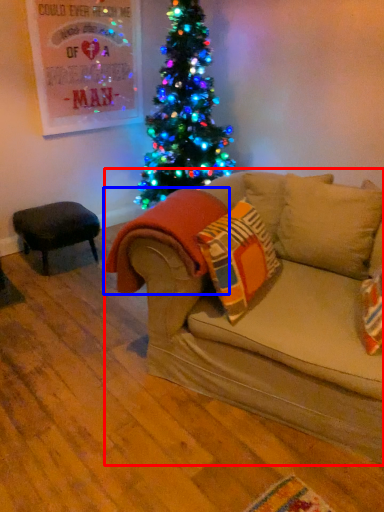
Question: Which point is closer to the camera, studio couch (highlighted by a red box) or blanket (highlighted by a blue box)?

Choices:
 (A) studio couch
 (B) blanket

Answer: (A)